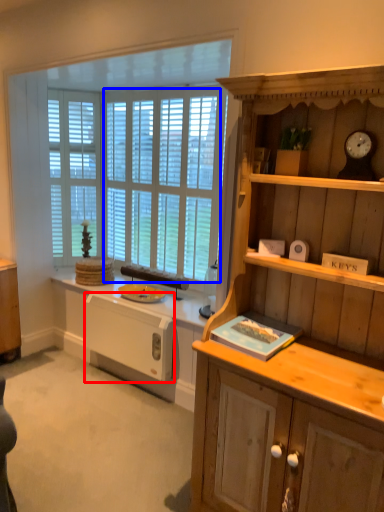
Question: Which point is further to the camera, appliance (highlighted by a red box) or window screen (highlighted by a blue box)?

Choices:
 (A) appliance
 (B) window screen

Answer: (B)